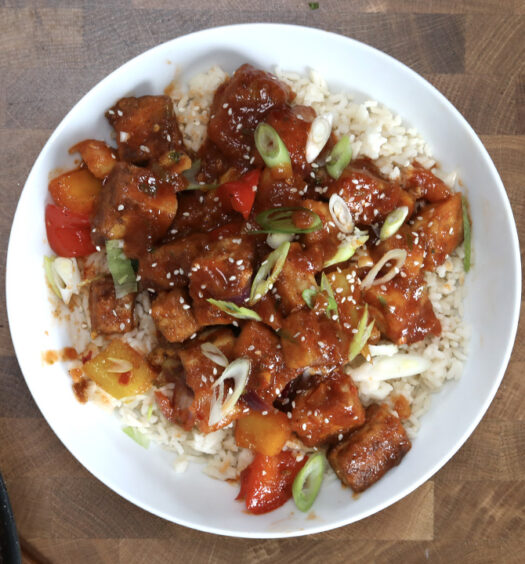
Identify the location of table. (59, 487), (482, 499), (467, 68), (52, 55).